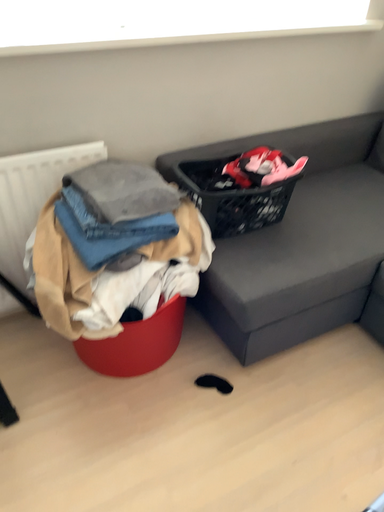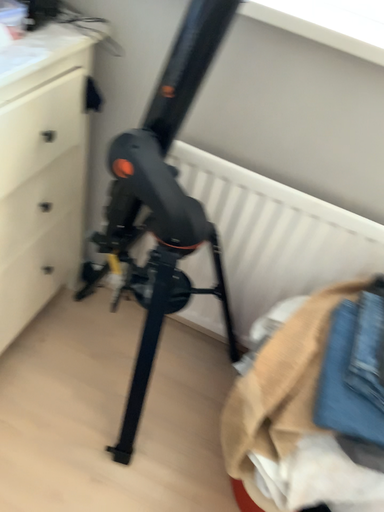
Question: Which way did the camera rotate in the video?

Choices:
 (A) rotated upward
 (B) rotated downward

Answer: (A)